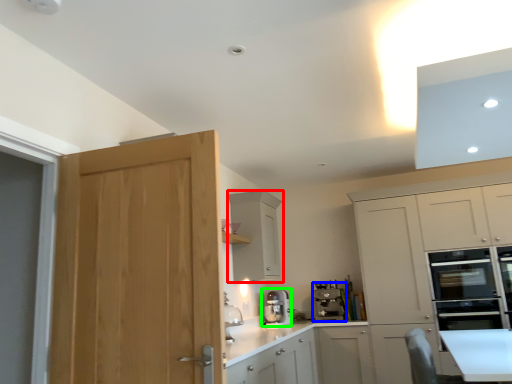
Question: Considering the real-world distances, which object is closest to cabinetry (highlighted by a red box)? kitchen appliance (highlighted by a blue box) or kitchen appliance (highlighted by a green box).

Choices:
 (A) kitchen appliance
 (B) kitchen appliance

Answer: (B)